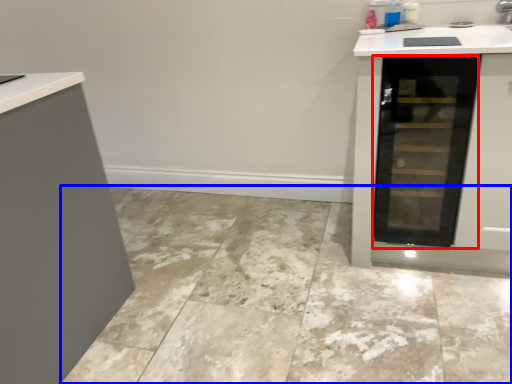
Question: Which object is further to the camera taking this photo, glass door (highlighted by a red box) or ceramic tile (highlighted by a blue box)?

Choices:
 (A) glass door
 (B) ceramic tile

Answer: (A)